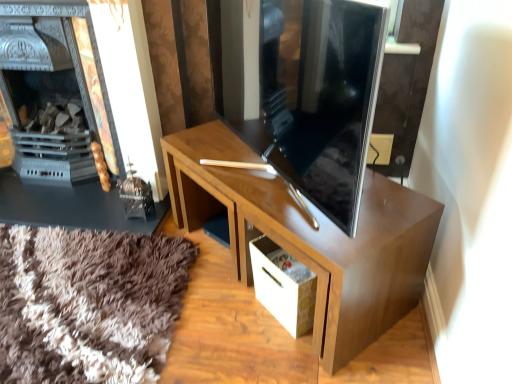
Locate an element on the screen. Image resolution: width=512 pixels, height=384 pixels. vacant area in front of white cardboard drawer at lower center is located at coordinates (283, 359).